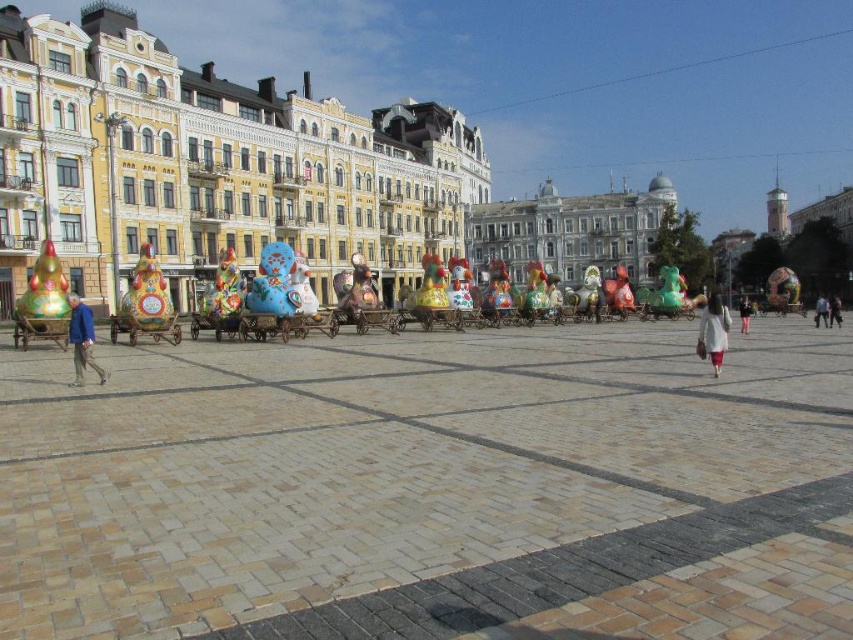
Measure the distance between white cotton dress at center and camera.

white cotton dress at center and camera are 53.80 meters apart.

Which is behind, point (724, 310) or point (86, 310)?

The point (724, 310) is behind.

Is point (712, 332) in front of point (73, 330)?

No, (712, 332) is further to viewer.

Image resolution: width=853 pixels, height=640 pixels. What are the coordinates of `white cotton dress at center` in the screenshot? It's located at (712, 332).

Find the location of a particular element. white cotton dress at center is located at coordinates [712, 332].

Can you confirm if white cotton dress at center is shorter than blue denim jeans at lower right?

No, white cotton dress at center is not shorter than blue denim jeans at lower right.

Is point (717, 371) farther from camera compared to point (822, 324)?

No.

Locate an element on the screen. This screenshot has height=640, width=853. white cotton dress at center is located at coordinates (712, 332).

Can you confirm if blue denim jeans at lower right is wider than pink fabric dress at center?

Yes.

Is point (825, 317) closer to camera compared to point (741, 321)?

No.

Describe the element at coordinates (821, 310) in the screenshot. This screenshot has height=640, width=853. I see `blue denim jeans at lower right` at that location.

At what (x,y) coordinates should I click in order to perform the action: click on blue denim jeans at lower right. Please return your answer as a coordinate pair (x, y). Looking at the image, I should click on (821, 310).